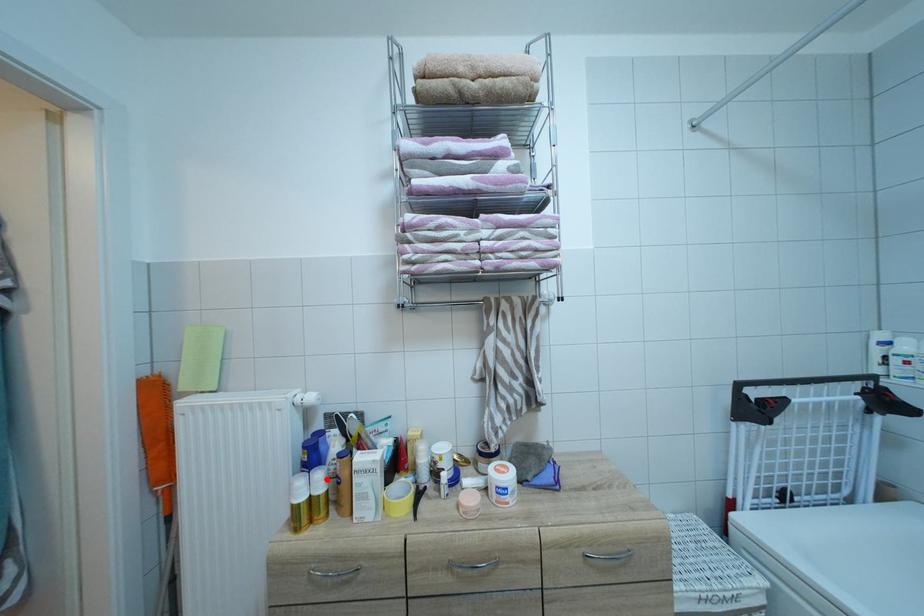
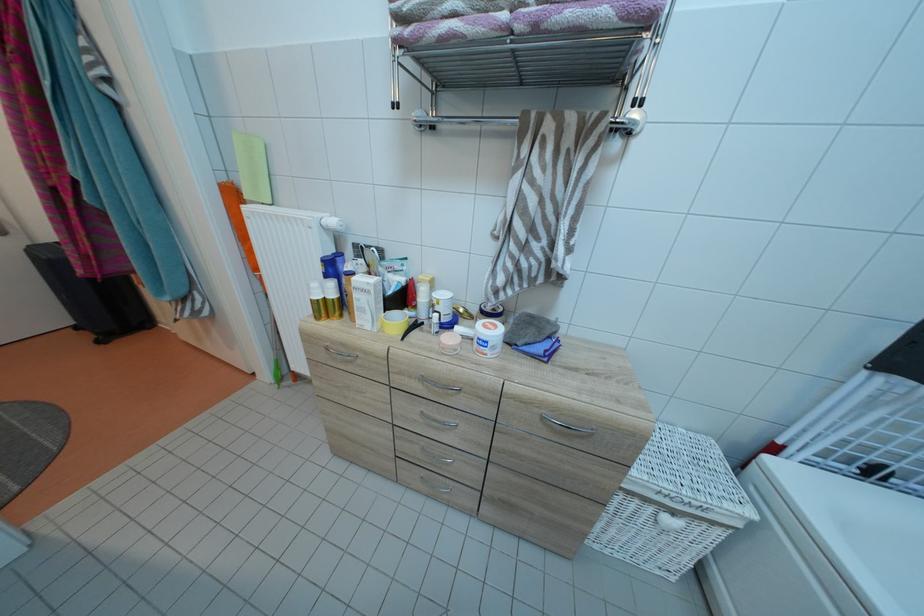
In the second image, find the point that corresponds to the highlighted location in the first image.

(338, 290)